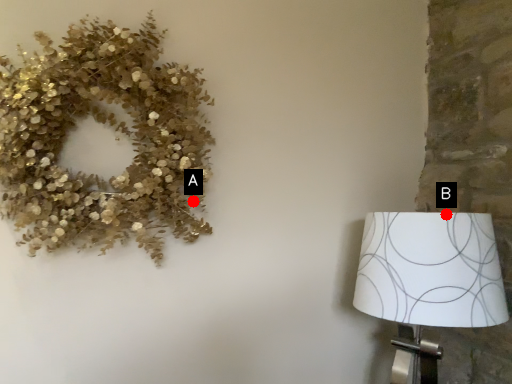
Question: Two points are circled on the image, labeled by A and B beside each circle. Among these points, which one is nearest to the camera?

Choices:
 (A) A is closer
 (B) B is closer

Answer: (B)